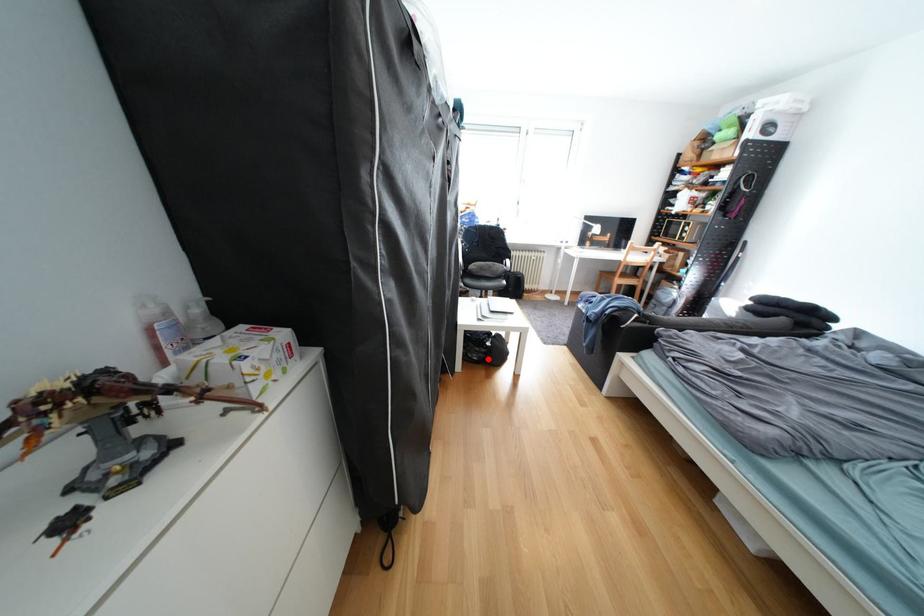
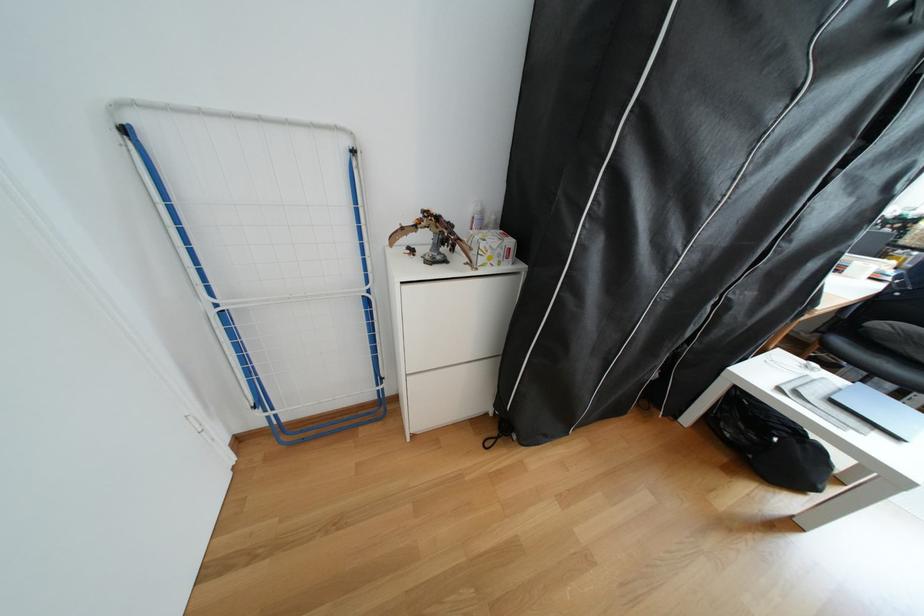
Question: I am providing you with two images of the same scene from different viewpoints. Image1 has a red point marked. In image2, the corresponding 3D location appears at what relative position? Reply with the corresponding letter.

Choices:
 (A) Closer
 (B) Farther

Answer: (A)